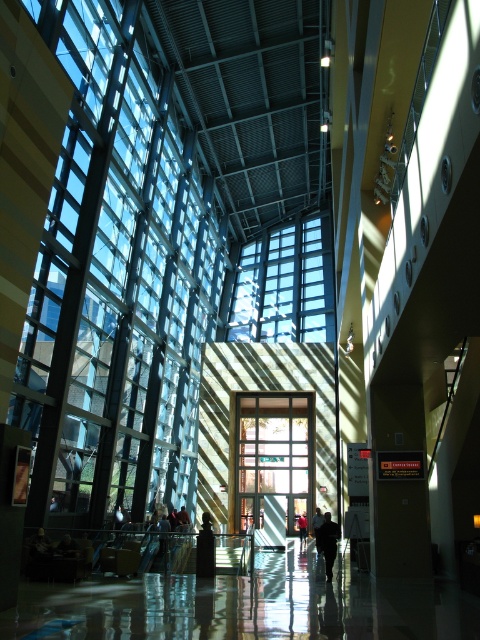
Is the position of dark gray jacket at center less distant than that of red shirt at center?

Yes, it is.

Can you confirm if dark gray jacket at center is taller than red shirt at center?

Incorrect, dark gray jacket at center's height is not larger of red shirt at center's.

Does point (325, 513) come closer to viewer compared to point (323, 522)?

No, (325, 513) is behind (323, 522).

This screenshot has height=640, width=480. I want to click on dark gray jacket at center, so click(327, 541).

How distant is red shirt at center from dark blue shirt at center?

The distance of red shirt at center from dark blue shirt at center is 3.91 meters.

Does red shirt at center appear under dark blue shirt at center?

No.

Find the location of a particular element. red shirt at center is located at coordinates [x=316, y=528].

Locate an element on the screen. red shirt at center is located at coordinates (316, 528).

Can you confirm if dark gray jacket at center is bigger than dark blue shirt at center?

Indeed, dark gray jacket at center has a larger size compared to dark blue shirt at center.

Find the location of a particular element. This screenshot has width=480, height=640. dark gray jacket at center is located at coordinates (327, 541).